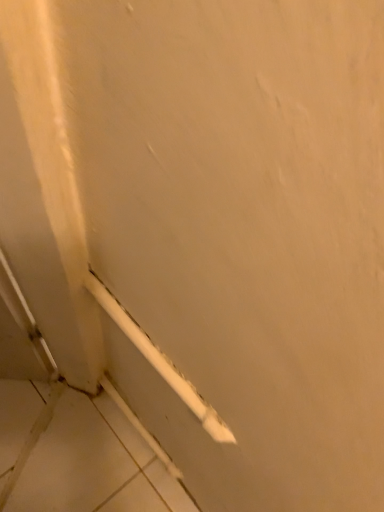
Find the location of a particular element. The width and height of the screenshot is (384, 512). white plastic molding at lower left is located at coordinates (159, 360).

The image size is (384, 512). What do you see at coordinates (159, 360) in the screenshot? I see `white plastic molding at lower left` at bounding box center [159, 360].

I want to click on white plastic molding at lower left, so click(159, 360).